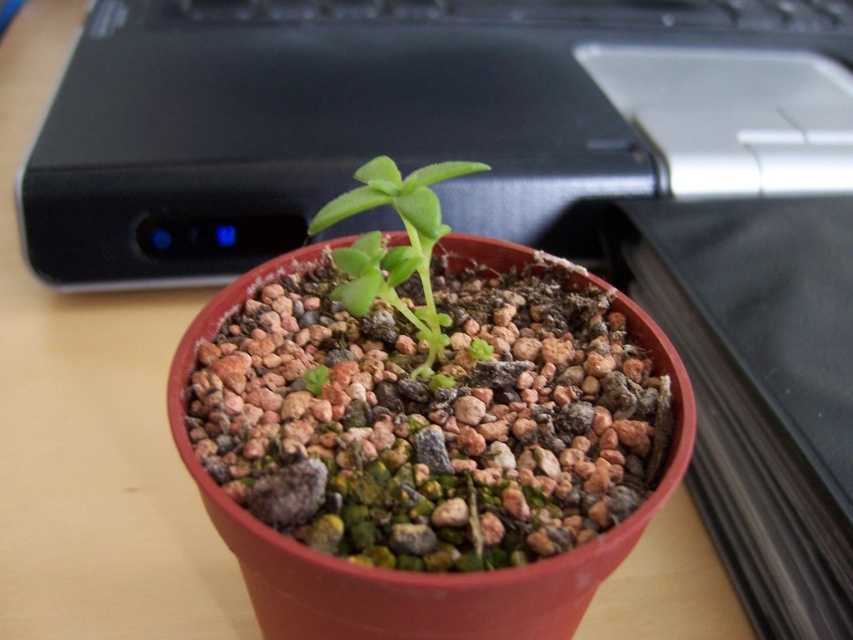
You are organizing a desk and need to place the black plastic computer at upper center and the green matte plant at center. Based on the scene, which object is positioned higher on the desk?

The black plastic computer at upper center is located above the green matte plant at center, so it is positioned higher on the desk.

You are organizing a desk and need to place both the black plastic keyboard at upper center and the green matte plant at center. Which object requires more desk space?

The green matte plant at center requires more desk space because it is larger than the black plastic keyboard at upper center.

You are organizing your desk and want to move the black plastic keyboard at upper center closer to the green matte plant at center. Based on their current positions, which direction should you move the keyboard to place it next to the plant?

The black plastic keyboard at upper center is currently to the right of the green matte plant at center. To place it next to the plant, you should move the keyboard to the left.